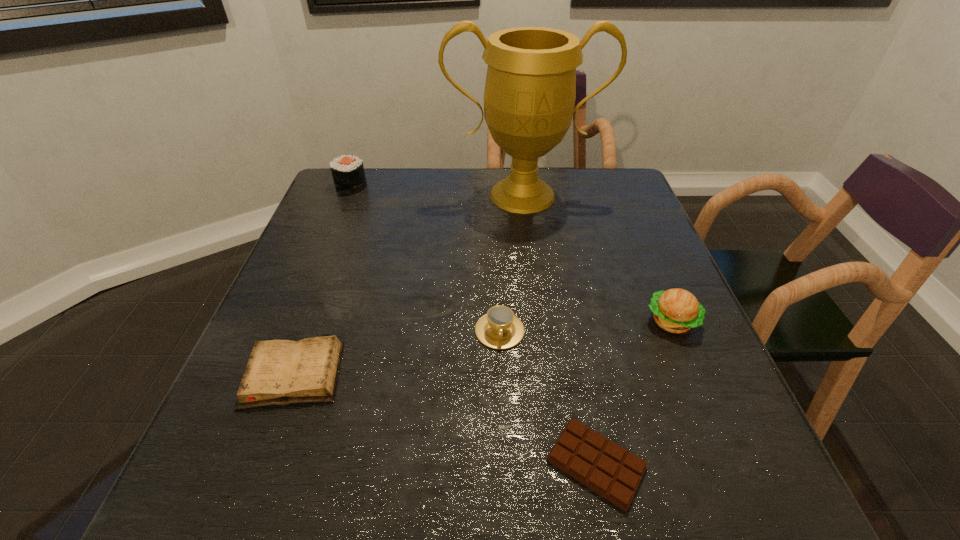
I want to click on unoccupied position between the sushi and the hamburger, so click(512, 254).

At what (x,y) coordinates should I click in order to perform the action: click on vacant area between the hamburger and the fifth tallest object. Please return your answer as a coordinate pair (x, y). Looking at the image, I should click on (483, 347).

This screenshot has width=960, height=540. Identify the location of unoccupied area between the tallest object and the fifth tallest object. (408, 284).

This screenshot has height=540, width=960. In order to click on free space between the rightmost object and the tallest object in this screenshot , I will do `click(597, 258)`.

Identify the location of vacant area between the sushi and the nearest object. (473, 325).

Locate an element on the screen. The height and width of the screenshot is (540, 960). unoccupied position between the third shortest object and the tallest object is located at coordinates (511, 263).

Where is `vacant space that's between the sushi and the fifth tallest object`? The width and height of the screenshot is (960, 540). vacant space that's between the sushi and the fifth tallest object is located at coordinates (323, 280).

Where is `object that is the closest to the rightmost object`? This screenshot has height=540, width=960. object that is the closest to the rightmost object is located at coordinates (608, 469).

Point out which object is positioned as the fourth nearest to the tallest object. Please provide its 2D coordinates. Your answer should be formatted as a tuple, i.e. [(x, y)], where the tuple contains the x and y coordinates of a point satisfying the conditions above.

[(279, 372)]

The height and width of the screenshot is (540, 960). I want to click on vacant region that satisfies the following two spatial constraints: 1. on the front side of the candy bar; 2. on the left side of the sushi, so click(240, 463).